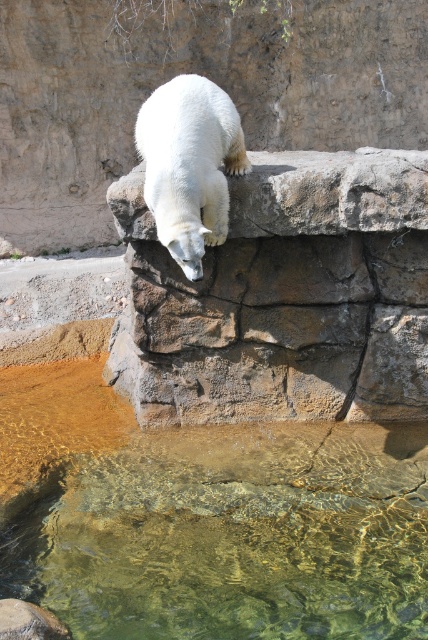
Question: Does clear glass water at lower center have a lesser width compared to brown rough stone at upper center?

Choices:
 (A) yes
 (B) no

Answer: (B)

Question: Which is nearer to the clear glass water at lower center?

Choices:
 (A) brown rough stone at upper center
 (B) white fur bear at upper center

Answer: (A)

Question: In this image, where is clear glass water at lower center located relative to white fur bear at upper center?

Choices:
 (A) below
 (B) above

Answer: (A)

Question: Which point is closer to the camera?

Choices:
 (A) brown rough stone at upper center
 (B) clear glass water at lower center
 (C) white fur bear at upper center

Answer: (B)

Question: Is clear glass water at lower center smaller than brown rough stone at upper center?

Choices:
 (A) no
 (B) yes

Answer: (B)

Question: Which of these objects is positioned closest to the white fur bear at upper center?

Choices:
 (A) clear glass water at lower center
 (B) brown rough stone at upper center

Answer: (B)